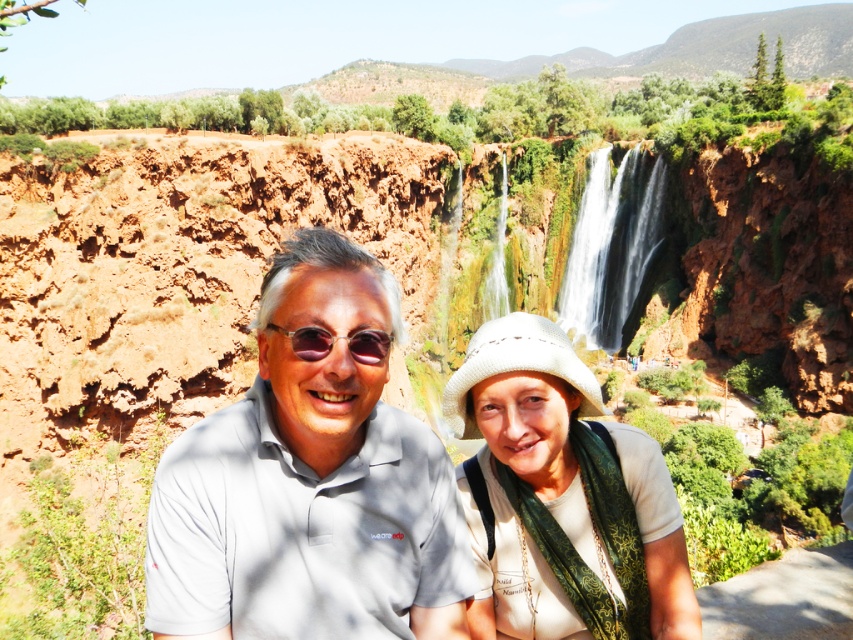
From the picture: Who is higher up, gray cotton polo shirt at center or sunglasses at center?

sunglasses at center is above.

Is gray cotton polo shirt at center thinner than sunglasses at center?

Incorrect, gray cotton polo shirt at center's width is not less than sunglasses at center's.

Which is in front, point (331, 244) or point (292, 342)?

Point (292, 342) is more forward.

This screenshot has height=640, width=853. I want to click on gray cotton polo shirt at center, so click(x=309, y=483).

Is the position of white textured waterfall at center more distant than that of sunglasses at center?

Yes, white textured waterfall at center is behind sunglasses at center.

Does point (560, 296) lie in front of point (306, 348)?

No, it is not.

Who is more forward, (621, 198) or (297, 333)?

Point (297, 333) is more forward.

The width and height of the screenshot is (853, 640). In order to click on white textured waterfall at center in this screenshot , I will do `click(611, 246)`.

Is point (383, 525) positioned behind point (560, 304)?

That is False.

Describe the element at coordinates (309, 483) in the screenshot. This screenshot has height=640, width=853. I see `gray cotton polo shirt at center` at that location.

Where is `gray cotton polo shirt at center`? gray cotton polo shirt at center is located at coordinates (309, 483).